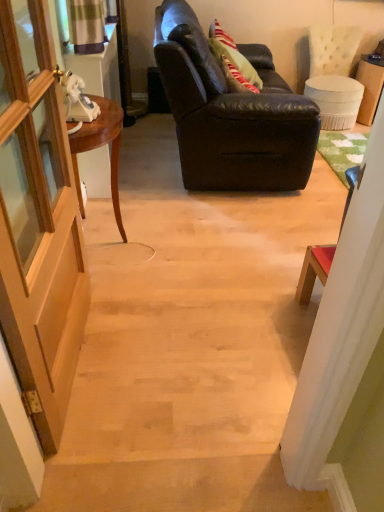
Question: Can you confirm if mahogany wood desk at left is shorter than green textured curtain at upper left?

Choices:
 (A) no
 (B) yes

Answer: (A)

Question: Is the position of mahogany wood desk at left more distant than that of green textured curtain at upper left?

Choices:
 (A) yes
 (B) no

Answer: (B)

Question: Is mahogany wood desk at left outside green textured curtain at upper left?

Choices:
 (A) no
 (B) yes

Answer: (B)

Question: Is mahogany wood desk at left closer to the viewer compared to green textured curtain at upper left?

Choices:
 (A) no
 (B) yes

Answer: (B)

Question: Can you confirm if mahogany wood desk at left is taller than green textured curtain at upper left?

Choices:
 (A) no
 (B) yes

Answer: (B)

Question: Is mahogany wood desk at left to the left or to the right of green textured curtain at upper left in the image?

Choices:
 (A) right
 (B) left

Answer: (A)

Question: From a real-world perspective, is mahogany wood desk at left above or below green textured curtain at upper left?

Choices:
 (A) above
 (B) below

Answer: (B)

Question: From the image's perspective, is mahogany wood desk at left positioned above or below green textured curtain at upper left?

Choices:
 (A) below
 (B) above

Answer: (A)

Question: Is mahogany wood desk at left wider or thinner than green textured curtain at upper left?

Choices:
 (A) thin
 (B) wide

Answer: (B)

Question: Is green textured curtain at upper left inside or outside of mahogany wood desk at left?

Choices:
 (A) inside
 (B) outside

Answer: (B)

Question: Considering the positions of green textured curtain at upper left and mahogany wood desk at left in the image, is green textured curtain at upper left wider or thinner than mahogany wood desk at left?

Choices:
 (A) wide
 (B) thin

Answer: (B)

Question: Considering their positions, is green textured curtain at upper left located in front of or behind mahogany wood desk at left?

Choices:
 (A) front
 (B) behind

Answer: (B)

Question: Is point (77, 26) closer or farther from the camera than point (77, 175)?

Choices:
 (A) closer
 (B) farther

Answer: (B)

Question: Based on their positions, is leather couch at upper center located to the left or right of wooden door at left?

Choices:
 (A) right
 (B) left

Answer: (A)

Question: In the image, is leather couch at upper center positioned in front of or behind wooden door at left?

Choices:
 (A) behind
 (B) front

Answer: (A)